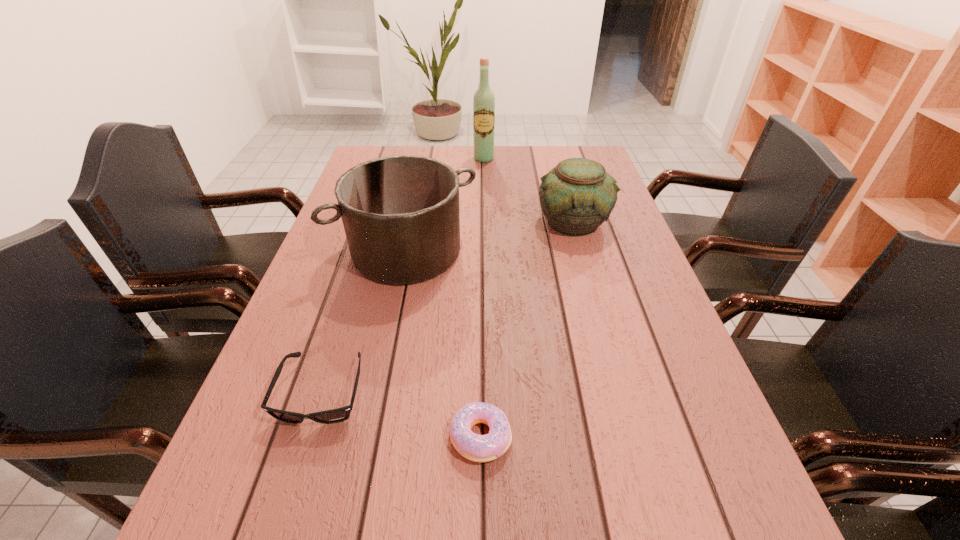
Locate an element on the screen. The width and height of the screenshot is (960, 540). the farthest object is located at coordinates click(484, 100).

In order to click on wine bottle in this screenshot , I will do `click(484, 100)`.

Locate an element on the screen. the fourth shortest object is located at coordinates (400, 213).

What are the coordinates of `pottery` in the screenshot? It's located at (577, 196).

Identify the location of the rightmost object. (577, 196).

Where is `the second shortest object`? This screenshot has height=540, width=960. the second shortest object is located at coordinates (341, 414).

At what (x,y) coordinates should I click in order to perform the action: click on doughnut. Please return your answer as a coordinate pair (x, y). Looking at the image, I should click on coord(479,448).

Where is `vacant space located 0.320m on the front-facing side of the wine bottle`? Image resolution: width=960 pixels, height=540 pixels. vacant space located 0.320m on the front-facing side of the wine bottle is located at coordinates (485, 214).

Where is `vacant point located on the right of the pan`? vacant point located on the right of the pan is located at coordinates (522, 251).

This screenshot has height=540, width=960. Find the location of `vacant space located on the back of the third tallest object`. vacant space located on the back of the third tallest object is located at coordinates (564, 185).